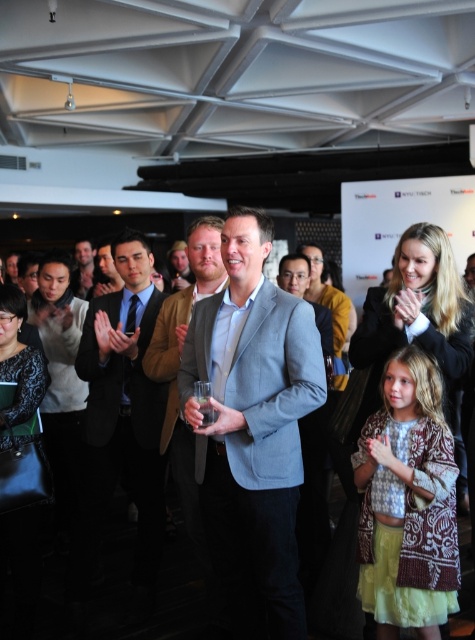
You are a photographer at the event and want to capture a photo that includes both the light gray suit at center and the matte black suit at center. Based on their positions, which suit should you focus on first to ensure both are in frame?

The light gray suit at center is positioned on the right side of matte black suit at center, so you should focus on the matte black suit at center first to ensure both are in frame by framing from the left to the right.

You are organizing a charity event and need to ensure that the two central suits displayed at the center of the venue are visible to all attendees. Given that the light gray suit at center is larger than the matte black suit at center, which suit should be placed closer to the back to ensure both are equally visible from the audience seats?

The matte black suit at center should be placed closer to the back since it is smaller than the light gray suit at center. This way, both suits will appear similarly sized from the audience seats, ensuring equal visibility.

You are standing in the event venue and want to move towards the two points marked in the image. Which point, point (108, 369) or point (87, 248), will you reach first?

Point (108, 369) is closer to the viewer than point (87, 248), so you will reach point (108, 369) first.